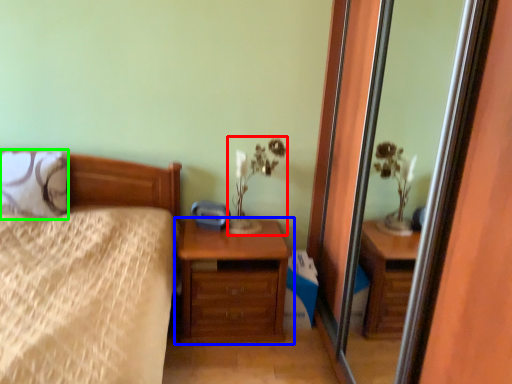
Question: Based on their relative distances, which object is farther from table lamp (highlighted by a red box)? Choose from chest of drawers (highlighted by a blue box) and pillow (highlighted by a green box).

Choices:
 (A) chest of drawers
 (B) pillow

Answer: (B)